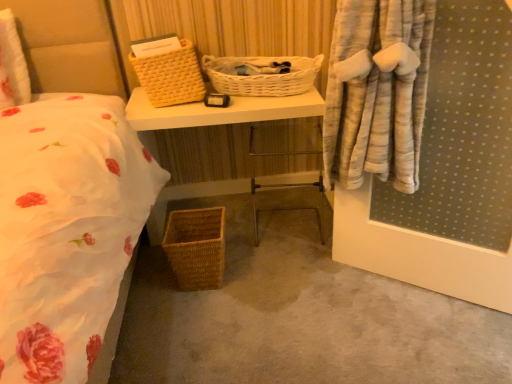
The width and height of the screenshot is (512, 384). Find the location of `vacant space that is in between metallic silver chair at center and woven brown picnic basket at lower center, the 1th picnic basket from the bottom`. vacant space that is in between metallic silver chair at center and woven brown picnic basket at lower center, the 1th picnic basket from the bottom is located at coordinates (258, 260).